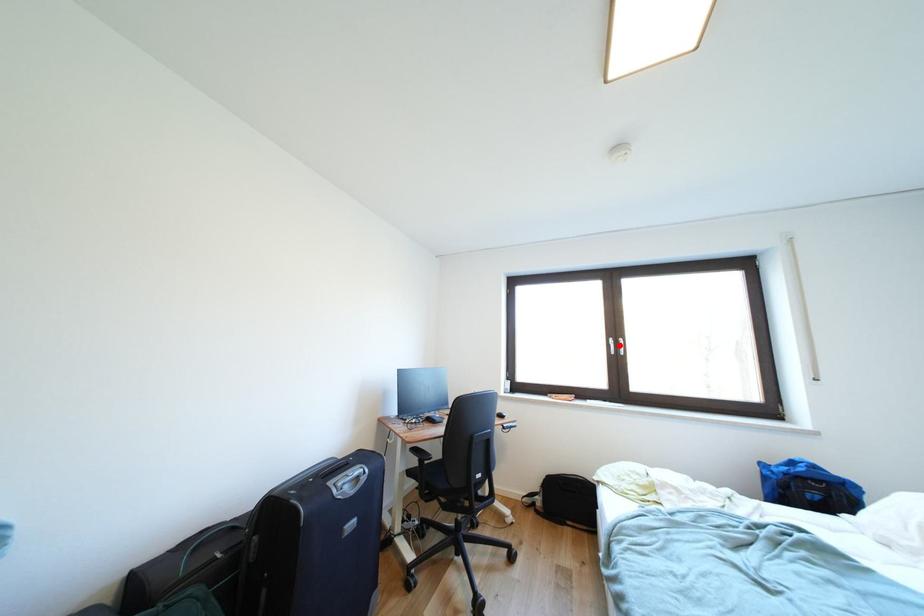
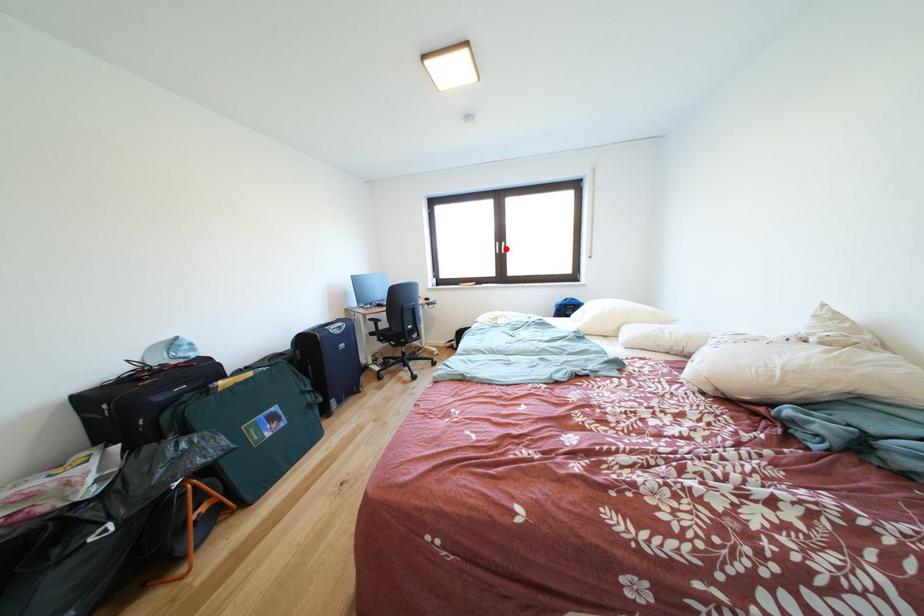
Based on the photo, I am providing you with two images of the same scene from different viewpoints. A red point is marked on the first image and another point is marked on the second image. Is the red point in image1 aligned with the point shown in image2?

Yes